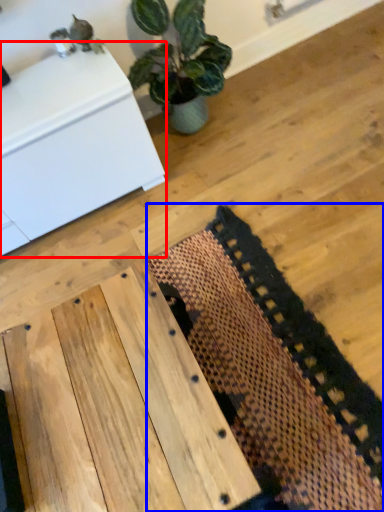
Question: Among these objects, which one is nearest to the camera, furniture (highlighted by a red box) or mat (highlighted by a blue box)?

Choices:
 (A) furniture
 (B) mat

Answer: (B)